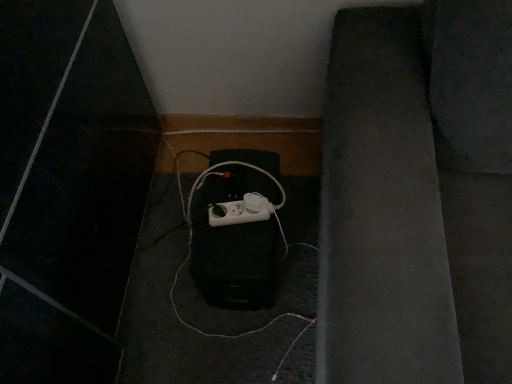
What do you see at coordinates (241, 211) in the screenshot? I see `white plastic power plugs and sockets at center` at bounding box center [241, 211].

At what (x,y) coordinates should I click in order to perform the action: click on white plastic power plugs and sockets at center. Please return your answer as a coordinate pair (x, y). Image resolution: width=512 pixels, height=384 pixels. Looking at the image, I should click on (241, 211).

At what (x,y) coordinates should I click in order to perform the action: click on white plastic power plugs and sockets at center. Please return your answer as a coordinate pair (x, y). Image resolution: width=512 pixels, height=384 pixels. Looking at the image, I should click on (241, 211).